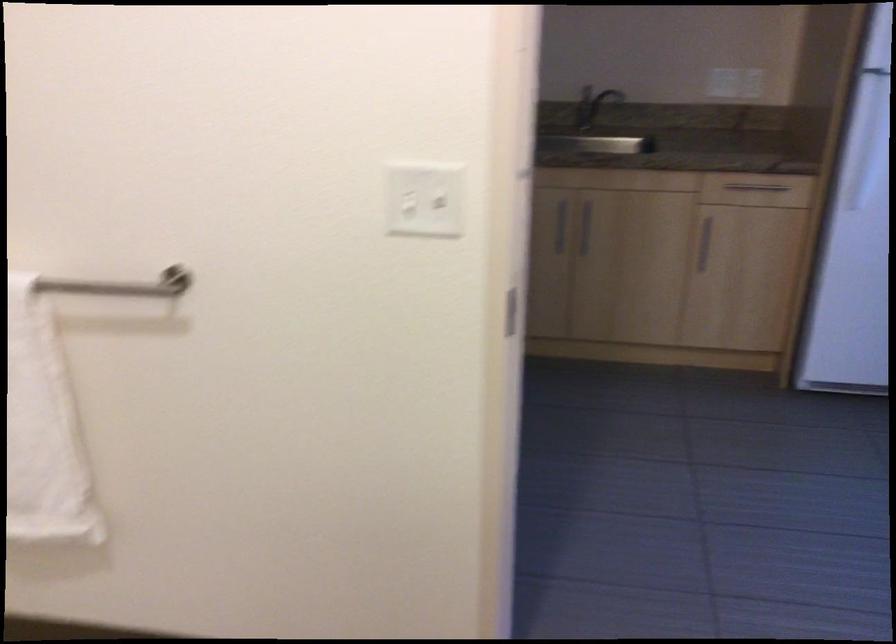
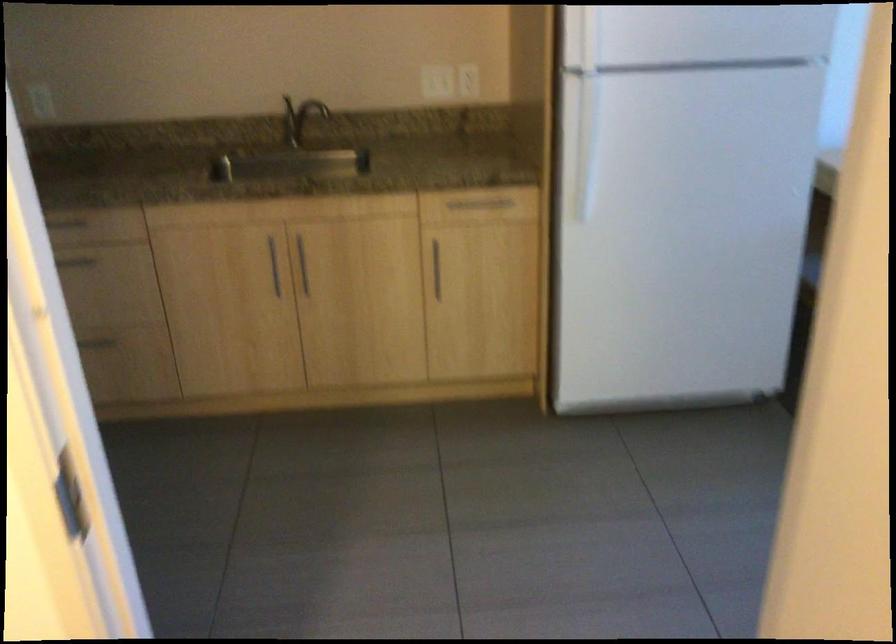
Find the pixel in the second image that matches point 576,225 in the first image.

(303, 265)